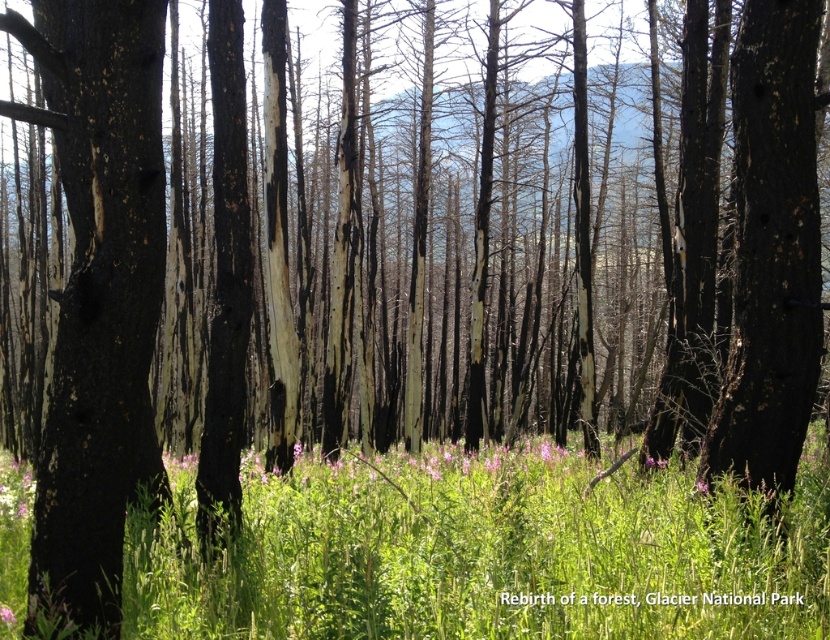
Is green grassy at center to the left of charred bark tree at center from the viewer's perspective?

Correct, you'll find green grassy at center to the left of charred bark tree at center.

Is green grassy at center closer to the viewer compared to charred bark tree at center?

That is True.

Is point (443, 516) more distant than point (806, 413)?

That is False.

Identify the location of green grassy at center. (486, 552).

Is the position of green grassy at center less distant than that of charred bark tree at left?

That is False.

Between green grassy at center and charred bark tree at left, which one has less height?

green grassy at center

The height and width of the screenshot is (640, 830). In order to click on green grassy at center in this screenshot , I will do `click(486, 552)`.

Is charred bark tree at left to the right of pink matte flower at center from the viewer's perspective?

Yes, charred bark tree at left is to the right of pink matte flower at center.

Is point (132, 150) closer to viewer compared to point (16, 621)?

Yes, point (132, 150) is closer to viewer.

Between point (86, 586) and point (3, 616), which one is positioned behind?

The point (3, 616) is more distant.

You are a GUI agent. You are given a task and a screenshot of the screen. Output one action in this format:
    pyautogui.click(x=<x>, y=<y>)
    Task: Click on the charred bark tree at left
    
    Given the screenshot: What is the action you would take?
    pyautogui.click(x=96, y=296)